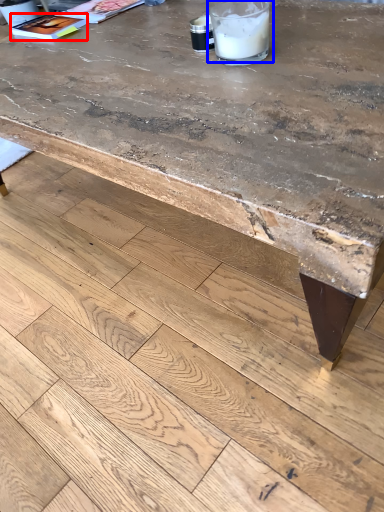
Question: Which of the following is the closest to the observer, magazine (highlighted by a red box) or drinking straw (highlighted by a blue box)?

Choices:
 (A) magazine
 (B) drinking straw

Answer: (B)